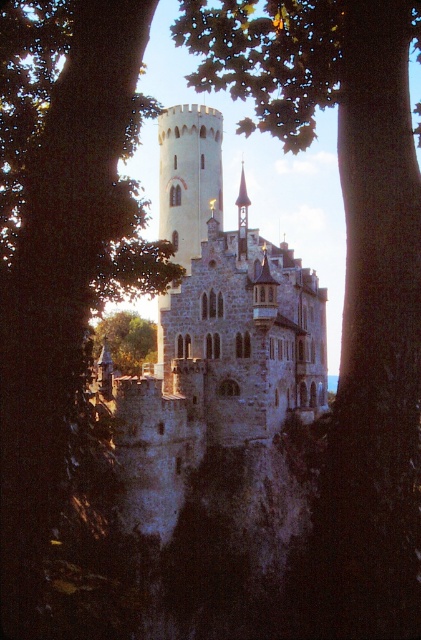
Does point (309, 380) come farther from viewer compared to point (111, 323)?

No, (309, 380) is in front of (111, 323).

Is point (221, 269) less distant than point (154, 353)?

That is True.

This screenshot has height=640, width=421. I want to click on stone castle at center, so click(212, 333).

How distant is white stone tower at center from green leafy tree at lower left?

white stone tower at center is 55.62 feet from green leafy tree at lower left.

Is point (181, 221) positioned behind point (130, 368)?

No, (181, 221) is closer to viewer.

The image size is (421, 640). Describe the element at coordinates (189, 177) in the screenshot. I see `white stone tower at center` at that location.

Locate an element on the screen. white stone tower at center is located at coordinates (189, 177).

Between stone castle at center and white stone tower at center, which one appears on the left side from the viewer's perspective?

white stone tower at center

Is point (221, 352) farther from camera compared to point (210, 138)?

That is False.

This screenshot has width=421, height=640. What are the coordinates of `stone castle at center` in the screenshot? It's located at (212, 333).